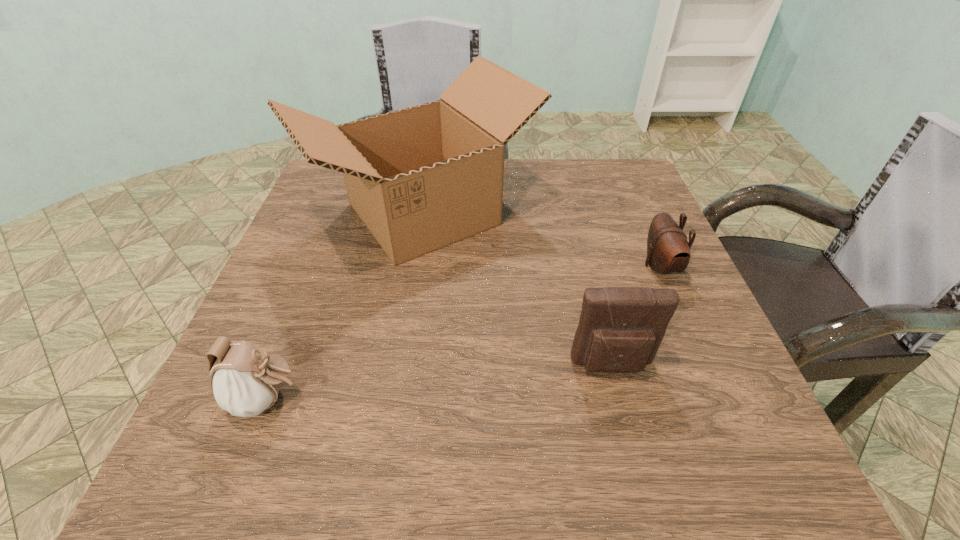
Find the location of a particular element. The image size is (960, 540). free space between the second tallest pouch and the tallest pouch is located at coordinates (441, 382).

Image resolution: width=960 pixels, height=540 pixels. I want to click on the closest object to the box, so [x=620, y=329].

Locate which object is the closest to the second shortest pouch. Please provide its 2D coordinates. Your answer should be formatted as a tuple, i.e. [(x, y)], where the tuple contains the x and y coordinates of a point satisfying the conditions above.

[(422, 178)]

Select which pouch appears as the closest to the tallest pouch. Please provide its 2D coordinates. Your answer should be formatted as a tuple, i.e. [(x, y)], where the tuple contains the x and y coordinates of a point satisfying the conditions above.

[(668, 250)]

The width and height of the screenshot is (960, 540). I want to click on pouch that stands as the second closest to the rightmost object, so click(x=245, y=381).

The width and height of the screenshot is (960, 540). In order to click on vacant area in the image that satisfies the following two spatial constraints: 1. on the front side of the box; 2. on the front-facing side of the third tallest object in this screenshot , I will do `click(395, 399)`.

I want to click on free region that satisfies the following two spatial constraints: 1. with an open flap on the third object from left to right; 2. on the front-facing side of the third tallest object, so click(x=620, y=399).

This screenshot has width=960, height=540. In order to click on free space that satisfies the following two spatial constraints: 1. with the flap open on the rightmost object; 2. with an open flap on the tallest pouch in this screenshot , I will do `click(703, 366)`.

I want to click on vacant area that satisfies the following two spatial constraints: 1. with an open flap on the second object from right to left; 2. on the front-facing side of the second shortest pouch, so click(x=620, y=399).